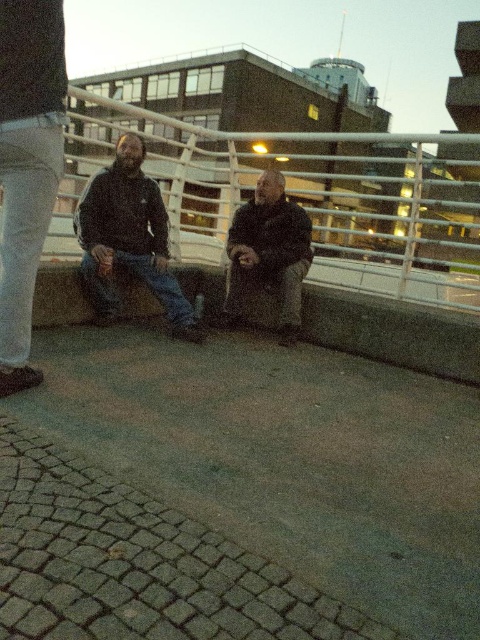
You are standing at the point marked as point (307, 195) in the image. What object are you facing?

The point (307, 195) corresponds to the white metal rail at center, so you are facing the white metal rail at center.

You are a photographer trying to capture a photo of the white metal rail at center and the dark gray sweater at center. Which object will appear taller in the final photo?

The white metal rail at center will appear taller in the photo because it is much taller than the dark gray sweater at center.

You are a photographer trying to capture a photo of the dark gray sweater at center and the denim at left. Which object should you focus on first if you want to ensure both are in focus, considering their heights?

The dark gray sweater at center is much taller than the denim at left, so you should focus on the dark gray sweater at center first to ensure both are in focus.